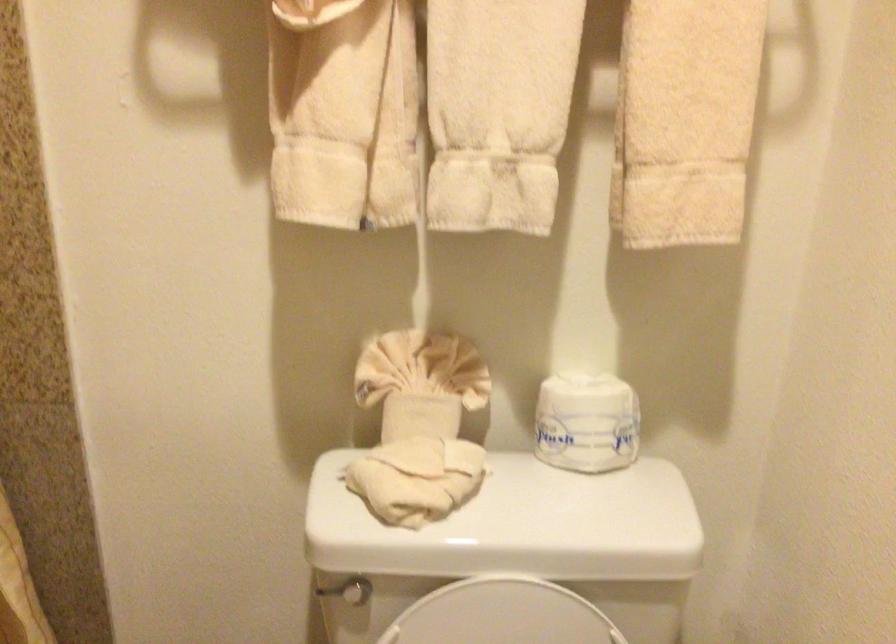
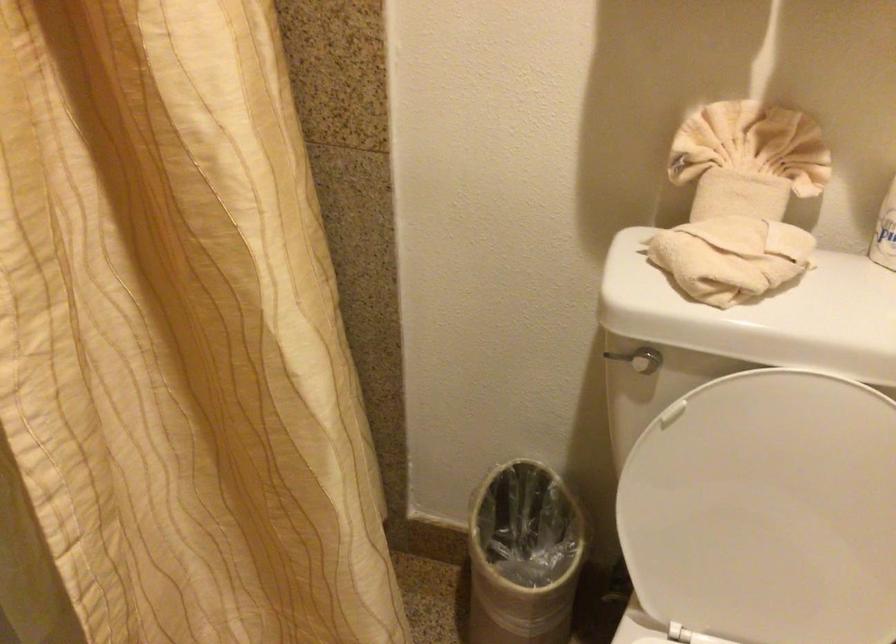
The point at [419,483] is marked in the first image. Where is the corresponding point in the second image?

(730, 257)